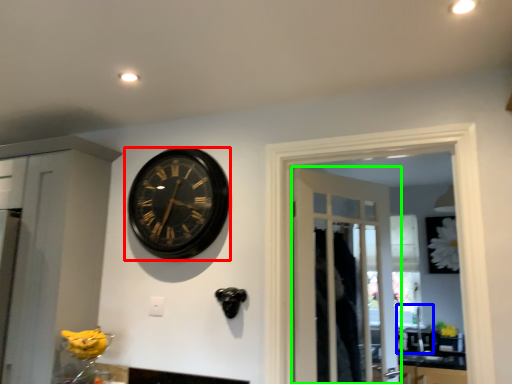
Question: Which is nearer to the wall clock (highlighted by a red box)? sink (highlighted by a blue box) or door (highlighted by a green box).

Choices:
 (A) sink
 (B) door

Answer: (B)